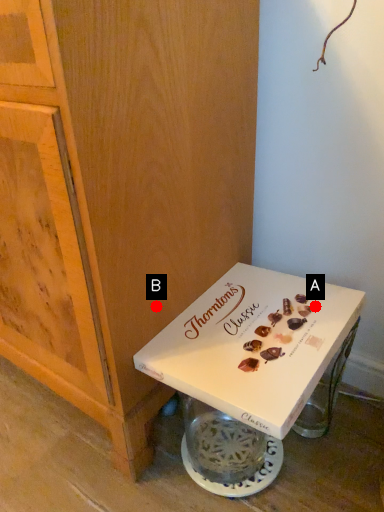
Question: Two points are circled on the image, labeled by A and B beside each circle. Which point appears closest to the camera in this image?

Choices:
 (A) A is closer
 (B) B is closer

Answer: (B)